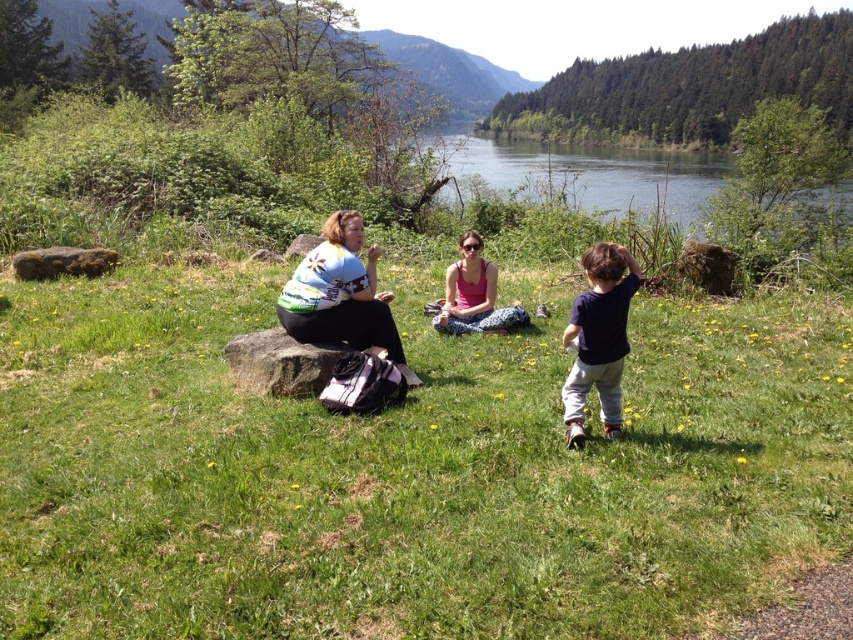
Question: Estimate the real-world distances between objects in this image. Which object is farther from the matte floral shirt at center?

Choices:
 (A) dark blue t-shirt at right
 (B) pink fabric at center
 (C) brown rough rock at left
 (D) smooth gray rock at center

Answer: (C)

Question: Is clear blue water at center in front of brown rough rock at left?

Choices:
 (A) yes
 (B) no

Answer: (B)

Question: Which of the following is the farthest from the observer?

Choices:
 (A) (444, 300)
 (B) (680, 177)
 (C) (247, 582)

Answer: (B)

Question: Does matte floral shirt at center come in front of pink fabric at center?

Choices:
 (A) yes
 (B) no

Answer: (A)

Question: Which point is closer to the camera taking this photo?

Choices:
 (A) (79, 262)
 (B) (613, 323)

Answer: (B)

Question: Observing the image, what is the correct spatial positioning of green grassy field at center in reference to brown rough rock at left?

Choices:
 (A) right
 (B) left

Answer: (A)